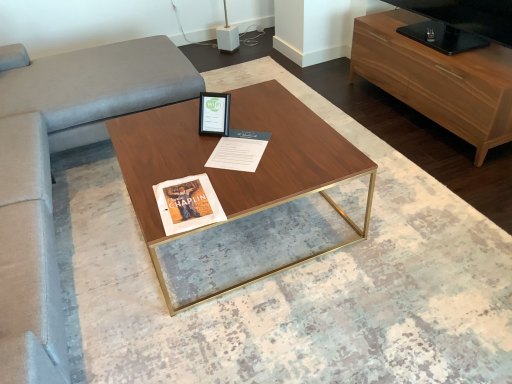
What are the coordinates of `free location to the right of white paper at center` in the screenshot? It's located at (291, 142).